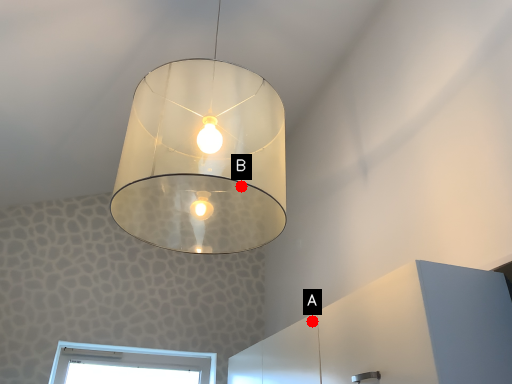
Question: Two points are circled on the image, labeled by A and B beside each circle. Which of the following is the farthest from the observer?

Choices:
 (A) A is further
 (B) B is further

Answer: (A)